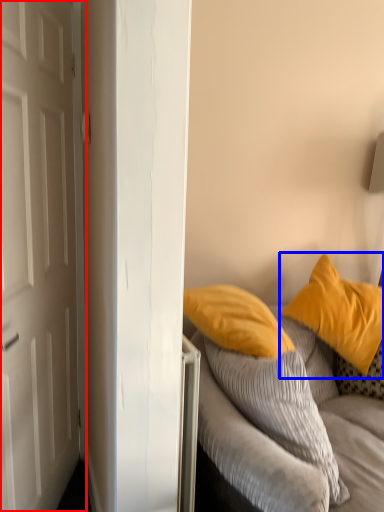
Question: Among these objects, which one is nearest to the camera, door (highlighted by a red box) or pillow (highlighted by a blue box)?

Choices:
 (A) door
 (B) pillow

Answer: (A)